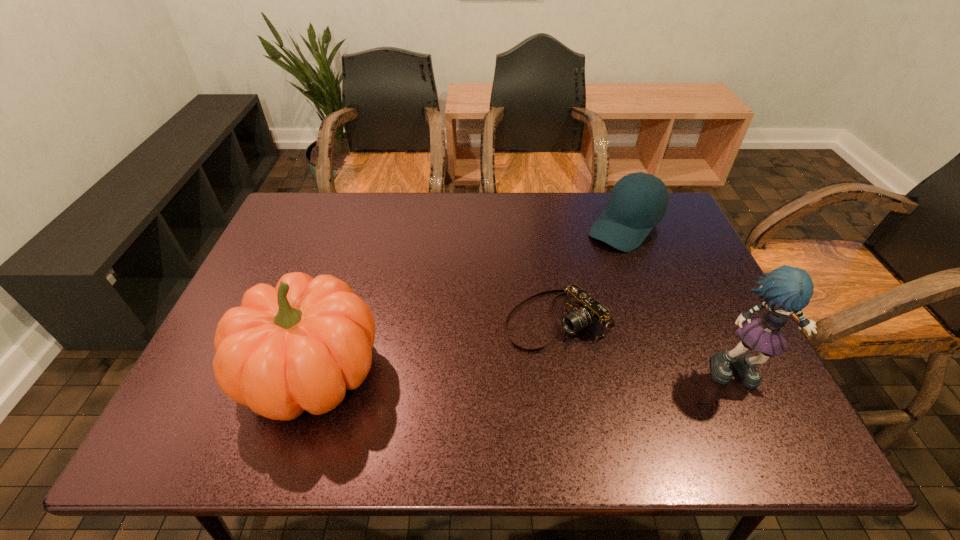
At what (x,y) coordinates should I click in order to perform the action: click on pumpkin. Please return your answer as a coordinate pair (x, y). The height and width of the screenshot is (540, 960). Looking at the image, I should click on (299, 346).

Identify the location of rag doll. (786, 290).

Where is `camera`? The width and height of the screenshot is (960, 540). camera is located at coordinates (584, 311).

You are a GUI agent. You are given a task and a screenshot of the screen. Output one action in this format:
    pyautogui.click(x=<x>, y=<y>)
    Task: Click on the third object from right to left
    
    Given the screenshot: What is the action you would take?
    pyautogui.click(x=584, y=311)

The image size is (960, 540). I want to click on the third tallest object, so click(638, 201).

This screenshot has width=960, height=540. In order to click on baseball cap in this screenshot , I will do `click(638, 201)`.

The image size is (960, 540). In order to click on blank area located on the right of the leftmost object in this screenshot , I will do `click(403, 373)`.

You are a GUI agent. You are given a task and a screenshot of the screen. Output one action in this format:
    pyautogui.click(x=<x>, y=<y>)
    Task: Click on the vacant region located 0.300m on the front-facing side of the shortest object
    This screenshot has height=540, width=960.
    Given the screenshot: What is the action you would take?
    pyautogui.click(x=401, y=399)

Identify the location of vacant region located on the front-facing side of the shortest object. (410, 395).

Locate an element on the screen. free space located on the front-facing side of the shortest object is located at coordinates (418, 390).